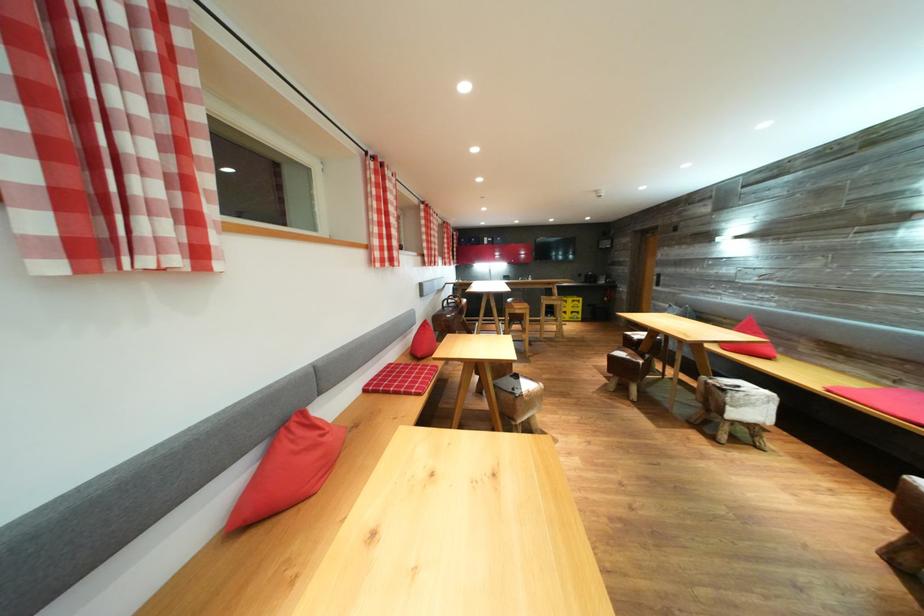
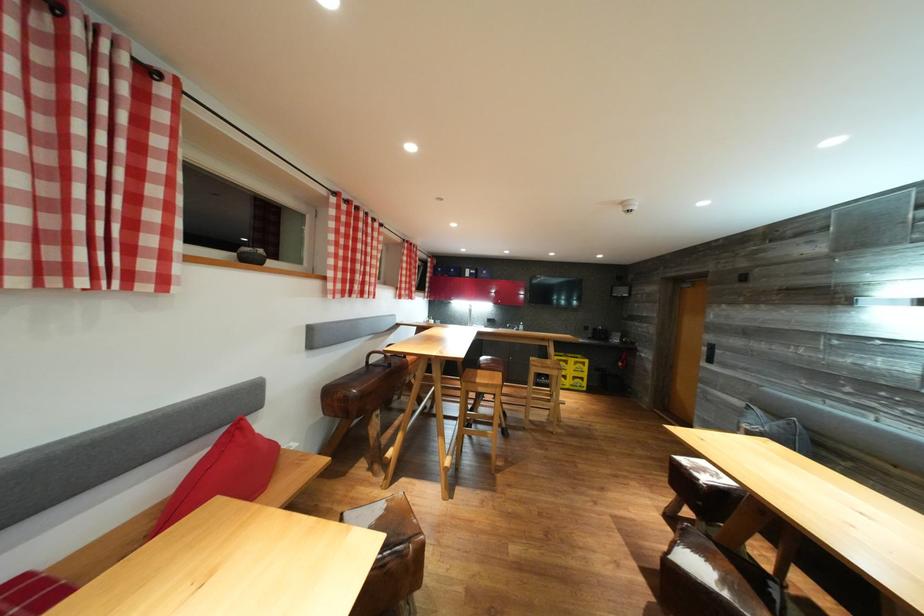
The point at (636, 339) is marked in the first image. Where is the corresponding point in the second image?

(689, 466)